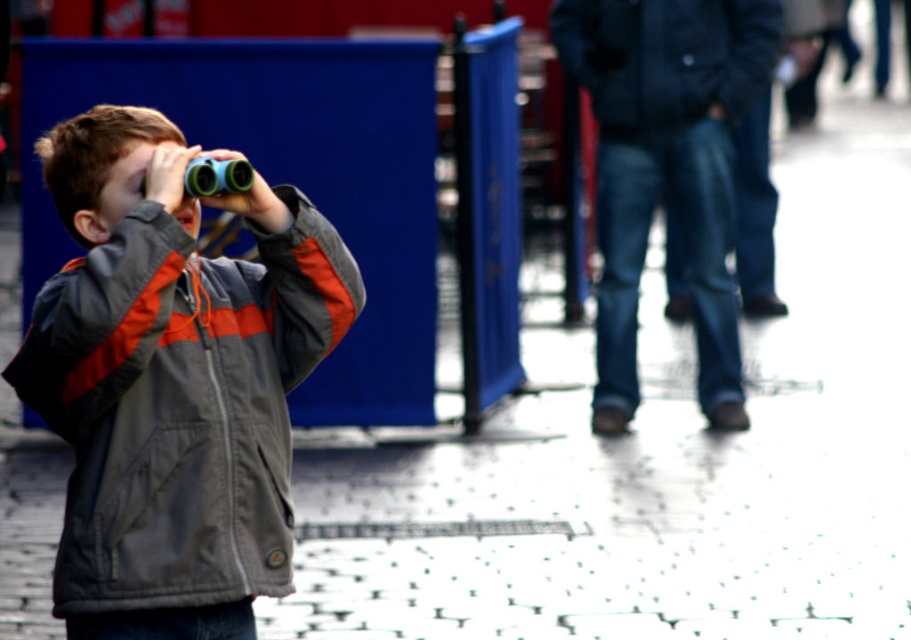
Question: Is gray fabric jacket at center behind dark blue jacket at upper right?

Choices:
 (A) yes
 (B) no

Answer: (B)

Question: Can you confirm if gray fabric jacket at center is positioned below dark blue jacket at upper right?

Choices:
 (A) no
 (B) yes

Answer: (B)

Question: Does gray fabric jacket at center appear under dark blue jacket at upper right?

Choices:
 (A) yes
 (B) no

Answer: (A)

Question: Which point appears farthest from the camera in this image?

Choices:
 (A) (344, 326)
 (B) (738, 22)

Answer: (B)

Question: Which object is farther from the camera taking this photo?

Choices:
 (A) dark blue jacket at upper right
 (B) gray fabric jacket at center

Answer: (A)